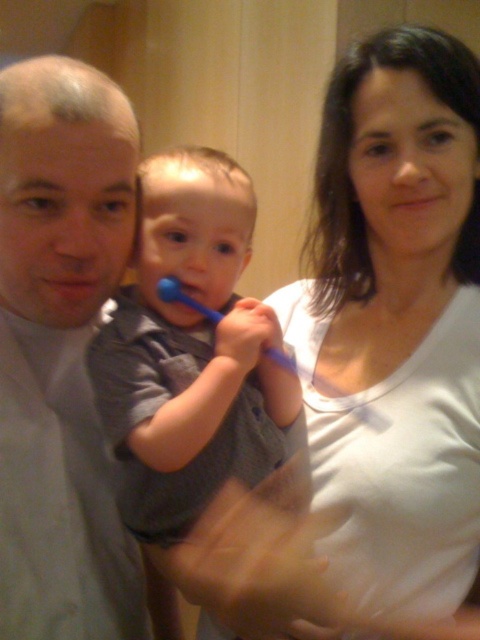
Question: Considering the real-world distances, which object is farthest from the dry matte lips at center?

Choices:
 (A) white matte shirt at upper right
 (B) blue rubber toothbrush at center

Answer: (A)

Question: Considering the relative positions of white matte shirt at upper right and dry matte lips at center in the image provided, where is white matte shirt at upper right located with respect to dry matte lips at center?

Choices:
 (A) above
 (B) below

Answer: (B)

Question: Which point is farther to the camera?

Choices:
 (A) white matte shirt at upper right
 (B) blue rubber toothbrush at center
 (C) dry matte lips at center

Answer: (B)

Question: From the image, what is the correct spatial relationship of white matte shirt at upper right in relation to smooth skin mouth at upper right?

Choices:
 (A) above
 (B) below

Answer: (B)

Question: Considering the real-world distances, which object is farthest from the matte gray shirt at left?

Choices:
 (A) blue rubber toothbrush at center
 (B) white matte shirt at upper right
 (C) dry matte lips at center
 (D) smooth skin mouth at upper right

Answer: (D)

Question: Does white matte shirt at upper right appear on the left side of dry matte lips at center?

Choices:
 (A) no
 (B) yes

Answer: (A)